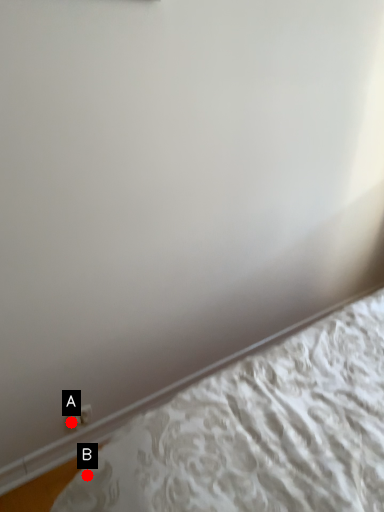
Question: Two points are circled on the image, labeled by A and B beside each circle. Which point is closer to the camera taking this photo?

Choices:
 (A) A is closer
 (B) B is closer

Answer: (B)